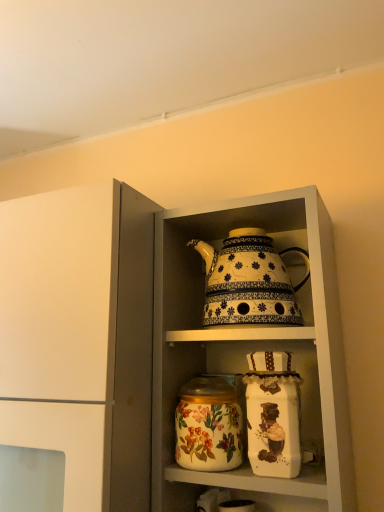
Describe the element at coordinates (249, 281) in the screenshot. I see `decorative ceramic teapot at center` at that location.

Locate an element on the screen. Image resolution: width=384 pixels, height=512 pixels. white glossy teapot at upper center is located at coordinates (156, 344).

Describe the element at coordinates (156, 344) in the screenshot. I see `white glossy teapot at upper center` at that location.

What is the approximate height of white glossy teapot at upper center?

26.00 inches.

Measure the distance between floral-patterned ceramic jar at center and camera.

A distance of 26.61 inches exists between floral-patterned ceramic jar at center and camera.

I want to click on decorative ceramic teapot at center, so click(x=249, y=281).

From the image's perspective, is white glossy teapot at upper center below floral-patterned ceramic jar at center?

No, from the image's perspective, white glossy teapot at upper center is not below floral-patterned ceramic jar at center.

Based on the photo, is white glossy teapot at upper center turned away from floral-patterned ceramic jar at center?

Correct, white glossy teapot at upper center is looking away from floral-patterned ceramic jar at center.

How distant is white glossy teapot at upper center from floral-patterned ceramic jar at center?

white glossy teapot at upper center is 8.18 inches from floral-patterned ceramic jar at center.

Is white glossy teapot at upper center situated inside floral-patterned ceramic jar at center or outside?

white glossy teapot at upper center lies outside floral-patterned ceramic jar at center.

In terms of width, does white glossy teapot at upper center look wider or thinner when compared to decorative ceramic teapot at center?

Clearly, white glossy teapot at upper center has more width compared to decorative ceramic teapot at center.

Is white glossy teapot at upper center taller than decorative ceramic teapot at center?

Indeed, white glossy teapot at upper center has a greater height compared to decorative ceramic teapot at center.

Between point (198, 325) and point (230, 322), which one is positioned behind?

The point (198, 325) is more distant.

Looking at this image, from the image's perspective, which one is positioned higher, white glossy teapot at upper center or decorative ceramic teapot at center?

decorative ceramic teapot at center, from the image's perspective.

Considering the relative positions of white glossy teapot at upper center and decorative ceramic teapot at center in the image provided, is white glossy teapot at upper center to the right of decorative ceramic teapot at center from the viewer's perspective?

No.

Which is further, (88, 282) or (271, 275)?

The point (271, 275) is farther from the camera.

Does white glossy teapot at upper center have a larger size compared to decorative ceramic teapot at center?

Yes.

Does point (221, 462) come closer to viewer compared to point (309, 275)?

Yes, it is.

Considering the positions of objects floral-patterned ceramic jar at center and decorative ceramic teapot at center in the image provided, who is more to the right, floral-patterned ceramic jar at center or decorative ceramic teapot at center?

From the viewer's perspective, decorative ceramic teapot at center appears more on the right side.

Where is `kettle that appears above the floral-patterned ceramic jar at center (from the image's perspective)`? kettle that appears above the floral-patterned ceramic jar at center (from the image's perspective) is located at coordinates (249, 281).

From a real-world perspective, is floral-patterned ceramic jar at center on decorative ceramic teapot at center?

No.

Is floral-patterned ceramic jar at center oriented towards white glossy teapot at upper center?

No, floral-patterned ceramic jar at center is not oriented towards white glossy teapot at upper center.

The width and height of the screenshot is (384, 512). What are the coordinates of `flower located on the right of white glossy teapot at upper center` in the screenshot? It's located at (208, 436).

Is floral-patterned ceramic jar at center to the right of white glossy teapot at upper center from the viewer's perspective?

Yes.

Is floral-patterned ceramic jar at center spatially inside white glossy teapot at upper center, or outside of it?

floral-patterned ceramic jar at center is spatially situated outside white glossy teapot at upper center.

Consider the image. Which of these two, decorative ceramic teapot at center or white glossy teapot at upper center, is smaller?

decorative ceramic teapot at center is smaller.

Looking at this image, considering the relative positions of decorative ceramic teapot at center and white glossy teapot at upper center in the image provided, is decorative ceramic teapot at center to the right of white glossy teapot at upper center from the viewer's perspective?

No, decorative ceramic teapot at center is not to the right of white glossy teapot at upper center.

How many degrees apart are the facing directions of decorative ceramic teapot at center and white glossy teapot at upper center?

1.49 degrees.

Would you say floral-patterned ceramic jar at center is to the left or to the right of white glossy teapot at upper center in the picture?

Based on their positions, floral-patterned ceramic jar at center is located to the left of white glossy teapot at upper center.

From a real-world perspective, which is physically above, floral-patterned ceramic jar at center or white glossy teapot at upper center?

From a 3D spatial view, white glossy teapot at upper center is above.

Considering the positions of objects floral-patterned ceramic jar at center and white glossy teapot at upper center in the image provided, who is in front, floral-patterned ceramic jar at center or white glossy teapot at upper center?

Positioned in front is white glossy teapot at upper center.

Is floral-patterned ceramic jar at center shorter than white glossy teapot at upper center?

Yes, floral-patterned ceramic jar at center is shorter than white glossy teapot at upper center.

There is a floral-patterned ceramic jar at center. Where is `cabinetry above it (from a real-world perspective)`? cabinetry above it (from a real-world perspective) is located at coordinates (156, 344).

Locate an element on the screen. The height and width of the screenshot is (512, 384). kettle above the white glossy teapot at upper center (from the image's perspective) is located at coordinates (249, 281).

Considering their positions, is floral-patterned ceramic jar at center positioned further to white glossy teapot at upper center than white glossy teapot at upper center?

floral-patterned ceramic jar at center is positioned further to the anchor white glossy teapot at upper center.

In the scene shown: Estimate the real-world distances between objects in this image. Which object is further from white glossy teapot at upper center, decorative ceramic teapot at center or floral-patterned ceramic jar at center?

Based on the image, floral-patterned ceramic jar at center appears to be further to white glossy teapot at upper center.

Based on the photo, estimate the real-world distances between objects in this image. Which object is further from floral-patterned ceramic jar at center, white glossy teapot at upper center or decorative ceramic teapot at center?

white glossy teapot at upper center is further to floral-patterned ceramic jar at center.

Considering their positions, is white glossy teapot at upper center positioned closer to floral-patterned ceramic jar at center than white glossy teapot at upper center?

white glossy teapot at upper center.

When comparing their distances from decorative ceramic teapot at center, does white glossy teapot at upper center or floral-patterned ceramic jar at center seem further?

white glossy teapot at upper center is further to decorative ceramic teapot at center.

Looking at this image, looking at the image, which one is located closer to white glossy teapot at upper center, white glossy teapot at upper center or decorative ceramic teapot at center?

white glossy teapot at upper center is positioned closer to the anchor white glossy teapot at upper center.

Considering their positions, is decorative ceramic teapot at center positioned further to white glossy teapot at upper center than white glossy teapot at upper center?

decorative ceramic teapot at center.

Looking at this image, which object lies further to the anchor point white glossy teapot at upper center, white glossy teapot at upper center or floral-patterned ceramic jar at center?

Among the two, floral-patterned ceramic jar at center is located further to white glossy teapot at upper center.

Locate an element on the screen. The image size is (384, 512). cabinetry between decorative ceramic teapot at center and floral-patterned ceramic jar at center from top to bottom is located at coordinates (156, 344).

Where is `kettle situated between white glossy teapot at upper center and white glossy teapot at upper center from left to right`? The height and width of the screenshot is (512, 384). kettle situated between white glossy teapot at upper center and white glossy teapot at upper center from left to right is located at coordinates (249, 281).

Identify the location of flower situated between white glossy teapot at upper center and decorative ceramic teapot at center from left to right. The width and height of the screenshot is (384, 512). (208, 436).

Find the location of a particular element. This screenshot has height=512, width=384. flower between white glossy teapot at upper center and white glossy teapot at upper center is located at coordinates pyautogui.click(x=208, y=436).